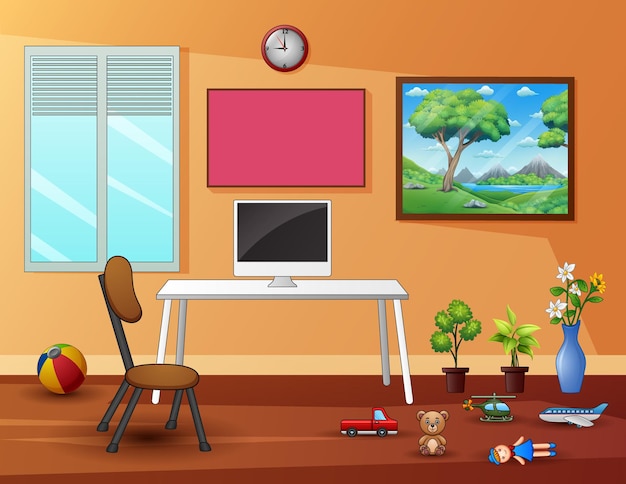
Where is `raised window blind - left side`? The image size is (626, 484). raised window blind - left side is located at coordinates (61, 73).